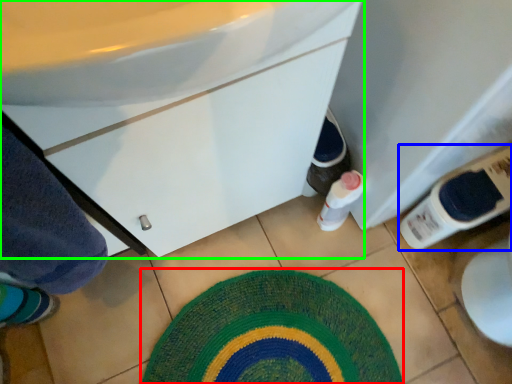
Question: Which is nearer to the bath mat (highlighted by a red box)? bottle (highlighted by a blue box) or bathroom cabinet (highlighted by a green box).

Choices:
 (A) bottle
 (B) bathroom cabinet

Answer: (A)